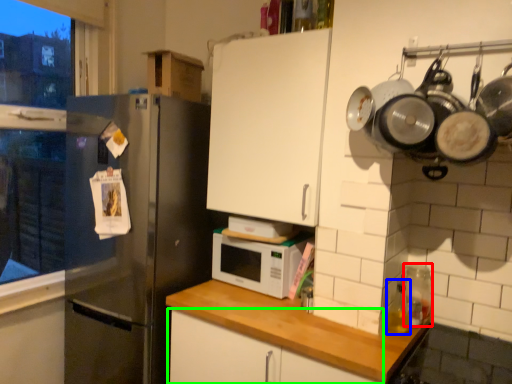
Question: Estimate the real-world distances between objects in this image. Which object is closer to appliance (highlighted by a red box), bottle (highlighted by a blue box) or cabinetry (highlighted by a green box)?

Choices:
 (A) bottle
 (B) cabinetry

Answer: (A)